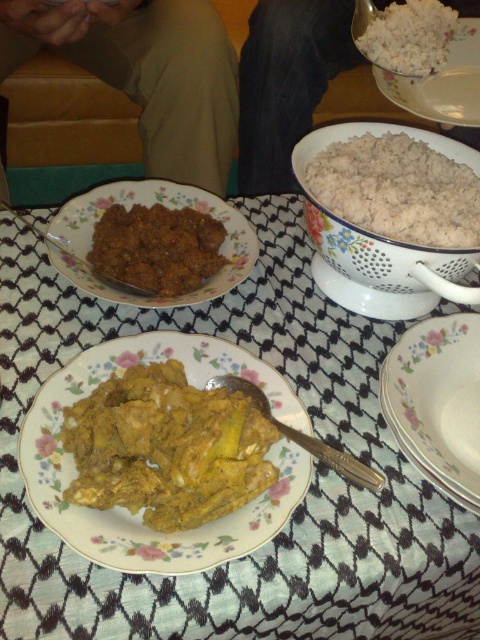
Question: Which object is closer to the camera taking this photo?

Choices:
 (A) yellow curry chicken at center
 (B) white ceramic bowl at upper center

Answer: (A)

Question: Which point is closer to the camera taking this photo?

Choices:
 (A) (21, 330)
 (B) (222, 456)
 (C) (457, 29)
 (D) (362, 52)

Answer: (B)

Question: Does brown fabric shirt at upper left have a greater width compared to brown crumbly at center?

Choices:
 (A) no
 (B) yes

Answer: (B)

Question: Which object is closer to the camera taking this photo?

Choices:
 (A) white matte rice at upper right
 (B) yellow curry chicken at center

Answer: (B)

Question: Does white porcelain plate at lower right have a larger size compared to brown crumbly at center?

Choices:
 (A) yes
 (B) no

Answer: (A)

Question: Can you confirm if yellow curry chicken at center is positioned above black fabric pants at lower center?

Choices:
 (A) yes
 (B) no

Answer: (B)